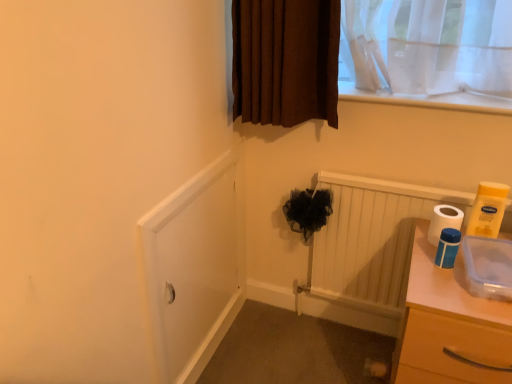
Where is `vacant space in front of blue plastic toilet paper at right, which is the third toilet paper from right to left`? The width and height of the screenshot is (512, 384). vacant space in front of blue plastic toilet paper at right, which is the third toilet paper from right to left is located at coordinates click(461, 294).